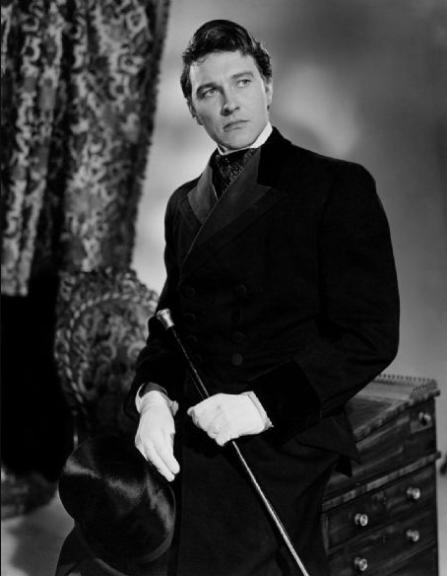
At what (x,y) coordinates should I click in order to perform the action: click on curtain. Please return your answer as a coordinate pair (x, y). The height and width of the screenshot is (576, 447). Looking at the image, I should click on (89, 192).